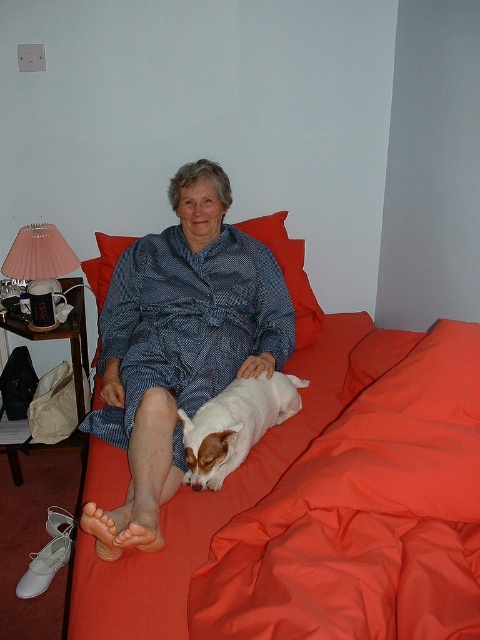
You are a photographer trying to capture the blue printed fabric at center and the white fur dog at center in the same frame. Based on their positions, which object should you adjust your camera to focus on first to ensure both are in the shot?

The blue printed fabric at center is to the left of the white fur dog at center, so you should focus on the white fur dog at center first to ensure both are in the frame.

You are a photographer trying to capture the blue printed fabric at center and the white fur dog at center in a single shot. Since the camera has a limited focus range, which object should you prioritize to ensure it stays in focus if you can only focus on one?

The blue printed fabric at center is bigger than the white fur dog at center, so you should prioritize focusing on the blue printed fabric at center to ensure it stays in focus.